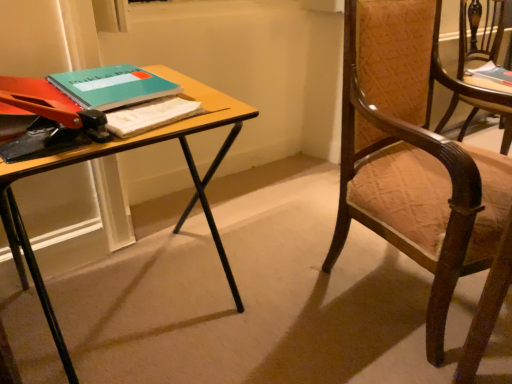
The height and width of the screenshot is (384, 512). I want to click on vacant space underneath wooden desk at center (from a real-world perspective), so click(x=138, y=319).